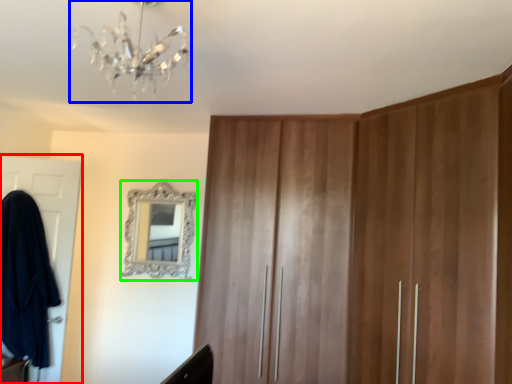
Question: Which object is positioned closest to door (highlighted by a red box)? Select from light fixture (highlighted by a blue box) and mirror (highlighted by a green box).

Choices:
 (A) light fixture
 (B) mirror

Answer: (B)